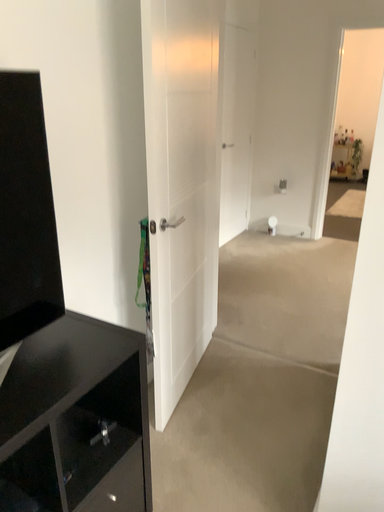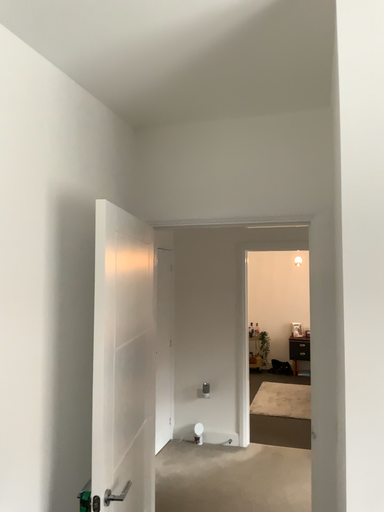
Question: Which way did the camera rotate in the video?

Choices:
 (A) rotated left
 (B) rotated right

Answer: (B)